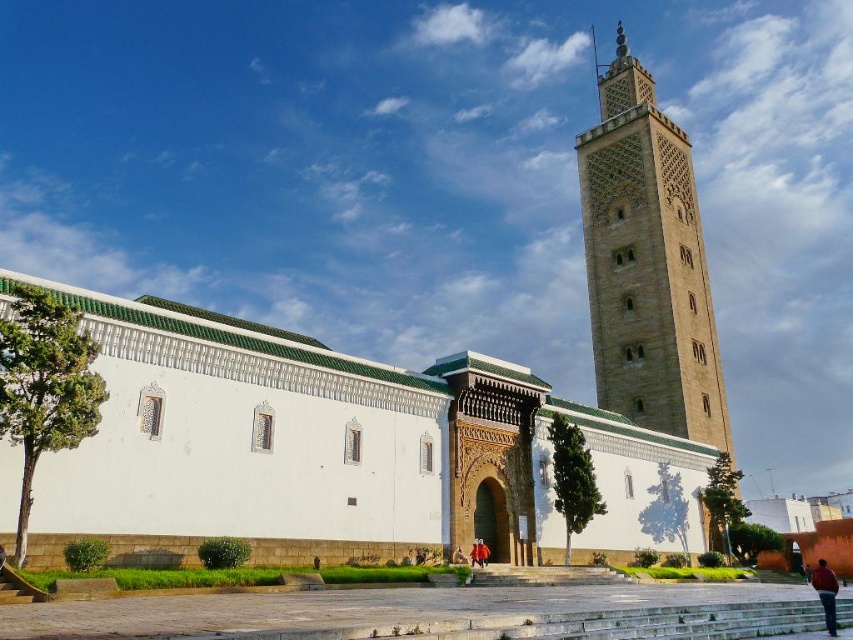
You are an architect analyzing the layout of this mosque. You need to determine the spatial relationship between the white textured wall at center and the brown stone minaret at upper right. Which object is located to the left of the other?

The white textured wall at center is positioned on the left side of brown stone minaret at upper right.

You are an architect analyzing the structure of the mosque in the image. You notice a specific point marked at coordinates (647, 264). Based on the mosque layout, what architectural feature is located at this coordinate?

The point at (647, 264) marks the location of the brown stone minaret at upper right.